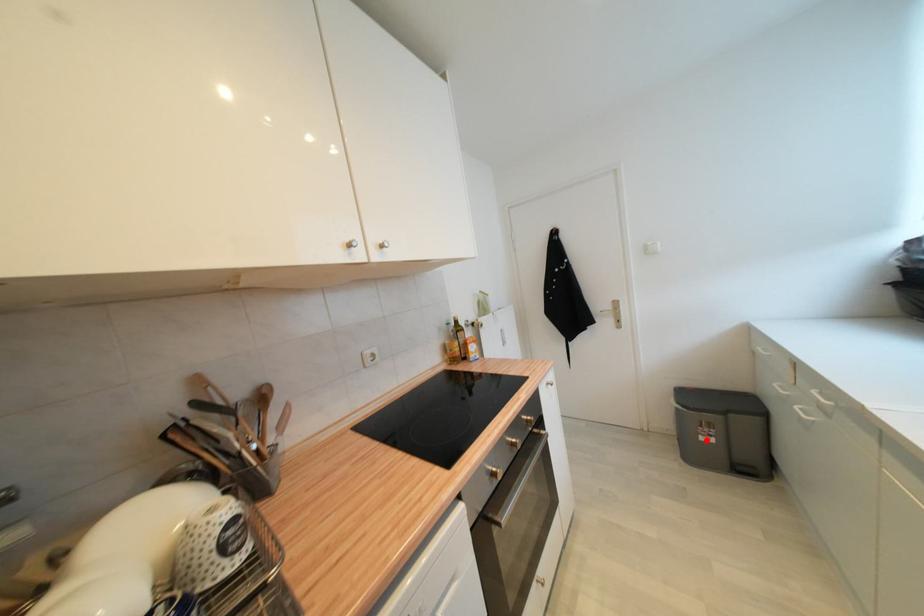
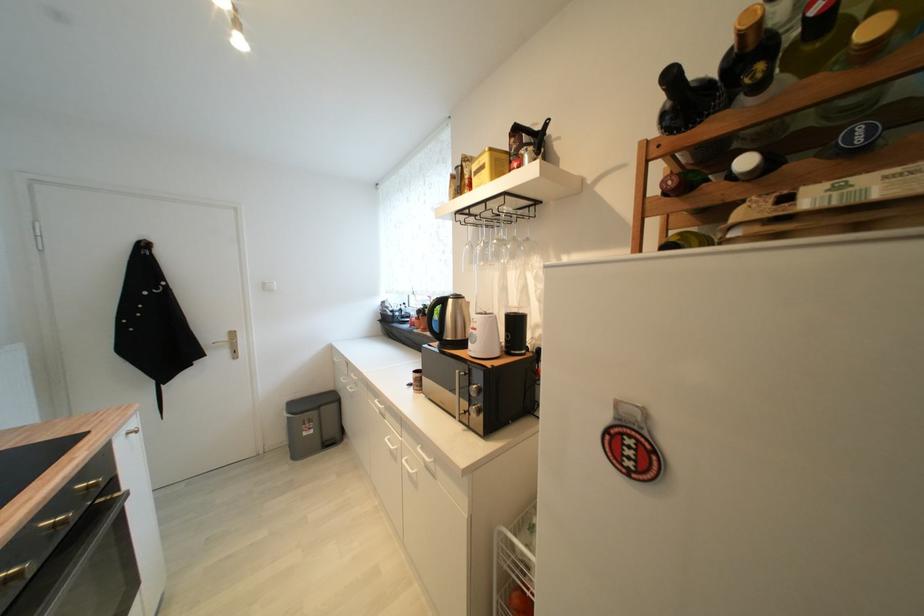
Question: A red point is marked in image1. In image2, is the corresponding 3D point closer to the camera or farther? Reply with the corresponding letter.

Choices:
 (A) The corresponding 3D point is closer.
 (B) The corresponding 3D point is farther.

Answer: (B)